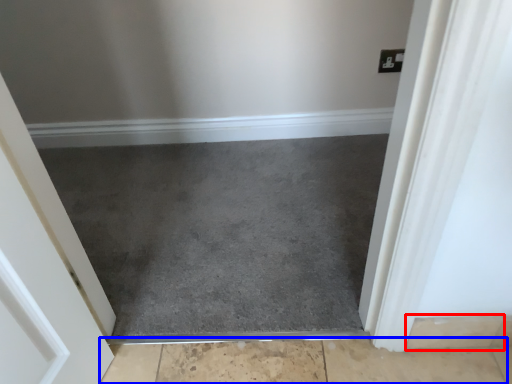
Question: Among these objects, which one is farthest to the camera, concrete (highlighted by a red box) or concrete (highlighted by a blue box)?

Choices:
 (A) concrete
 (B) concrete

Answer: (B)